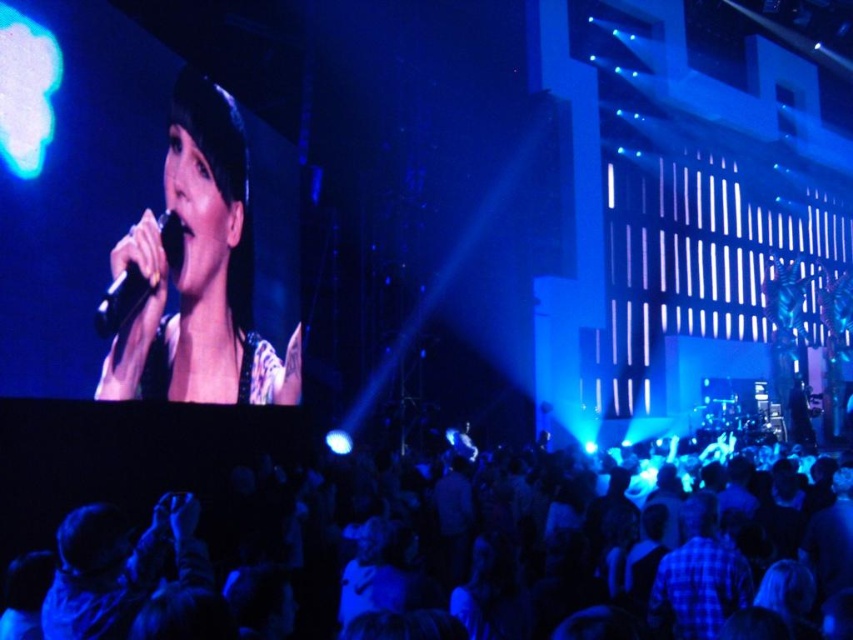
Question: Considering the relative positions of matte black microphone at upper left and black glossy microphone at upper left in the image provided, where is matte black microphone at upper left located with respect to black glossy microphone at upper left?

Choices:
 (A) right
 (B) left

Answer: (A)

Question: Estimate the real-world distances between objects in this image. Which object is closer to the matte black microphone at upper left?

Choices:
 (A) black glossy microphone at upper left
 (B) black fabric crowd at lower center

Answer: (A)

Question: Which point appears farthest from the camera in this image?

Choices:
 (A) (149, 285)
 (B) (107, 378)
 (C) (134, 472)

Answer: (C)

Question: Is black fabric crowd at lower center wider than black glossy microphone at upper left?

Choices:
 (A) yes
 (B) no

Answer: (A)

Question: Which object is farther from the camera taking this photo?

Choices:
 (A) matte black microphone at upper left
 (B) black fabric crowd at lower center
 (C) black glossy microphone at upper left

Answer: (A)

Question: Is black fabric crowd at lower center positioned in front of black glossy microphone at upper left?

Choices:
 (A) yes
 (B) no

Answer: (A)